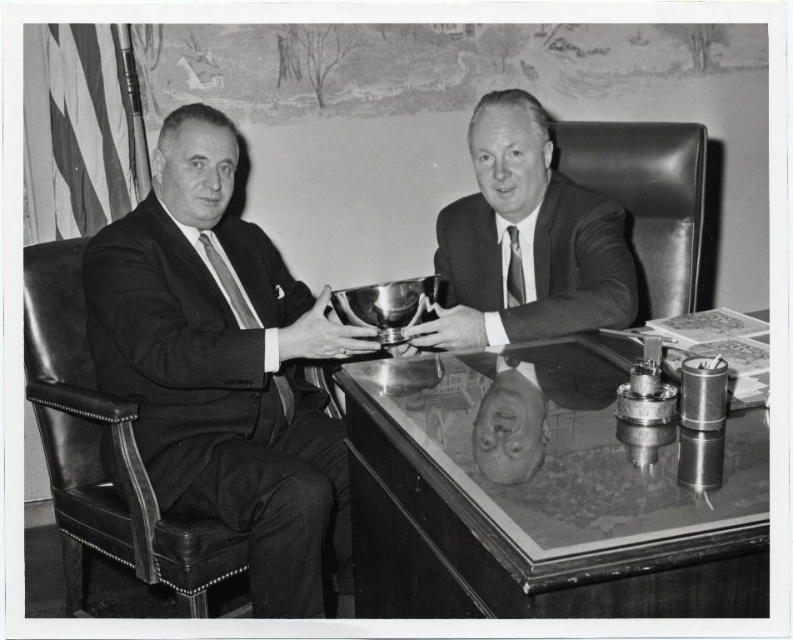
Question: Is shiny glass table at center to the left of shiny silver bowl at center from the viewer's perspective?

Choices:
 (A) no
 (B) yes

Answer: (B)

Question: Which object is farther from the camera taking this photo?

Choices:
 (A) shiny silver bowl at center
 (B) matte black suit at left
 (C) shiny glass table at center

Answer: (A)

Question: From the image, what is the correct spatial relationship of shiny glass table at center in relation to matte black suit at left?

Choices:
 (A) below
 (B) above

Answer: (A)

Question: Among these objects, which one is nearest to the camera?

Choices:
 (A) shiny silver bowl at center
 (B) matte black suit at left

Answer: (B)

Question: Does shiny glass table at center have a lesser width compared to shiny silver bowl at center?

Choices:
 (A) yes
 (B) no

Answer: (B)

Question: Among these points, which one is nearest to the camera?

Choices:
 (A) (303, 536)
 (B) (539, 314)

Answer: (A)